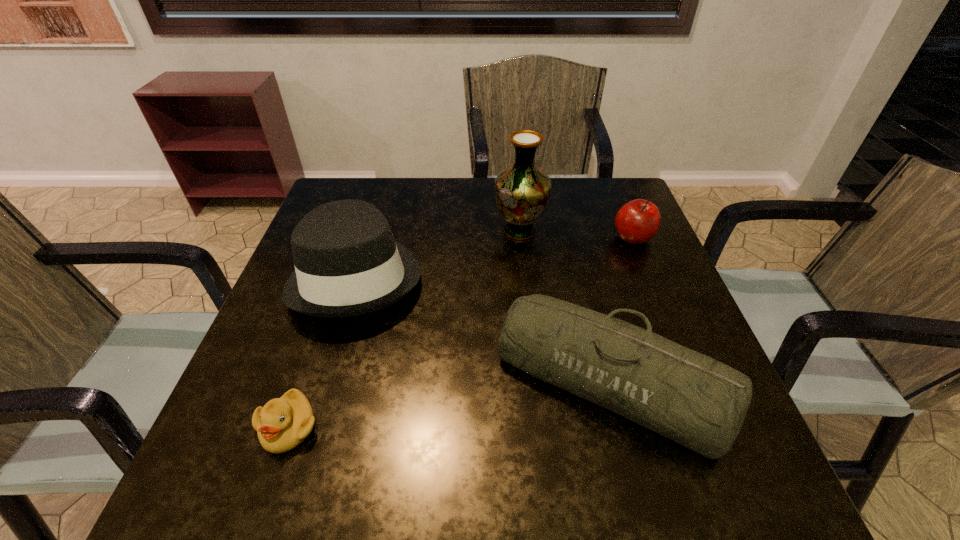
Image resolution: width=960 pixels, height=540 pixels. I want to click on vase at the far edge, so click(x=522, y=190).

Find the location of `apple that is at the far edge`. apple that is at the far edge is located at coordinates (636, 222).

Where is `duffel bag at the near edge`? This screenshot has height=540, width=960. duffel bag at the near edge is located at coordinates (688, 397).

You are a GUI agent. You are given a task and a screenshot of the screen. Output one action in this format:
    pyautogui.click(x=<x>, y=<y>)
    Task: Click on the duckling situated at the near edge
    
    Given the screenshot: What is the action you would take?
    pyautogui.click(x=283, y=423)

Find the location of a particular element. fedora located in the left edge section of the desktop is located at coordinates (347, 263).

Locate an element on the screen. Image resolution: width=960 pixels, height=540 pixels. duckling that is at the left edge is located at coordinates (283, 423).

Where is `duffel bag at the right edge`? duffel bag at the right edge is located at coordinates (688, 397).

Identify the location of apple that is at the right edge. (636, 222).

Image resolution: width=960 pixels, height=540 pixels. What are the coordinates of `object located in the near left corner section of the desktop` in the screenshot? It's located at [x=283, y=423].

The image size is (960, 540). Identify the location of object present at the far right corner. (636, 222).